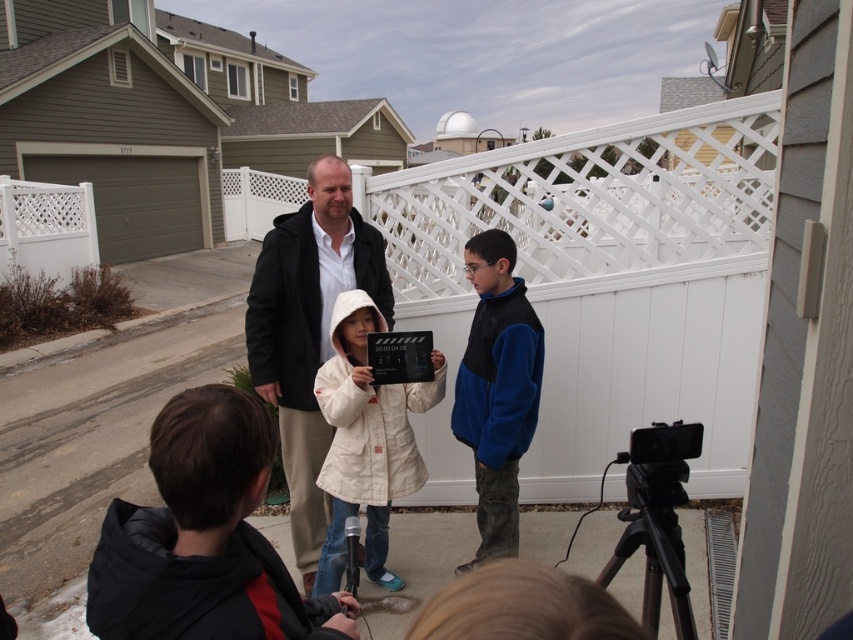
Question: Does white quilted coat at center have a greater width compared to black matte plaque at center?

Choices:
 (A) no
 (B) yes

Answer: (B)

Question: Among these points, which one is nearest to the camera?

Choices:
 (A) (201, 516)
 (B) (630, 492)
 (C) (508, 512)
 (D) (357, 465)

Answer: (A)

Question: Which point is closer to the camera?

Choices:
 (A) blue fleece vest at center
 (B) black plastic tripod at lower right
 (C) dark gray jacket at center

Answer: (B)

Question: Which point is farther from the camera taking this photo?

Choices:
 (A) (258, 500)
 (B) (521, 420)
 (C) (347, 250)

Answer: (C)

Question: Does dark gray jacket at center lie in front of white quilted coat at center?

Choices:
 (A) yes
 (B) no

Answer: (B)

Question: Is black fleece jacket at lower left positioned behind black plastic tripod at lower right?

Choices:
 (A) no
 (B) yes

Answer: (A)